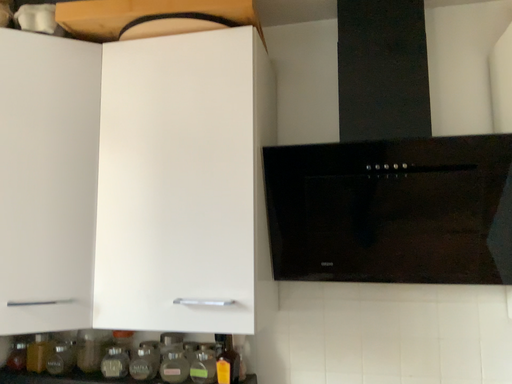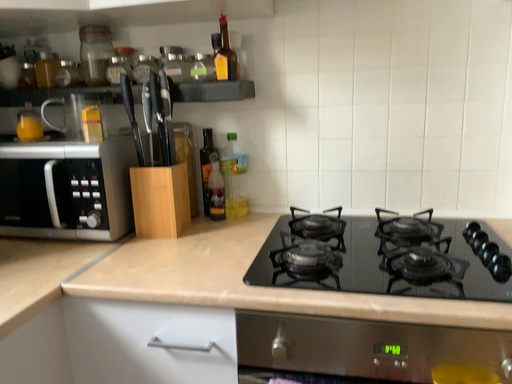
Question: Which way did the camera rotate in the video?

Choices:
 (A) rotated downward
 (B) rotated upward

Answer: (A)